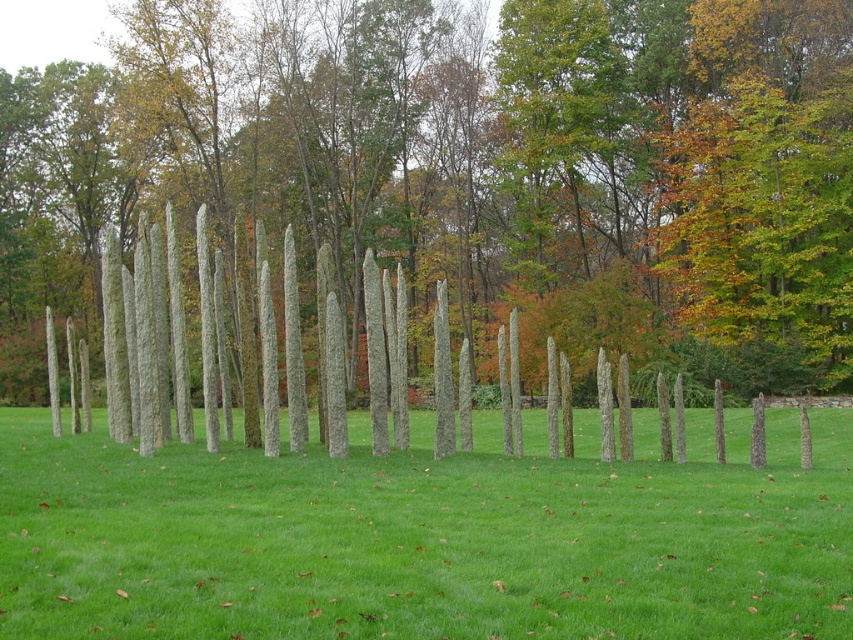
You are standing in the field among the obelisks and want to walk from the point at coordinates point [485,218] to the point at coordinates point [532,544]. Which direction should you face to move towards the second point?

Since point [485,218] is closer to you than point [532,544], you should face away from your current position towards the point [532,544] to move in the correct direction.

Looking at this image, you are a gardener who wants to plant a new flower bed between the smooth gray pole at center and the green grass at center. Which object should you move to make space?

The smooth gray pole at center is bigger than green grass at center, so you should move the smooth gray pole at center to make space for the flower bed.

You are standing in the middle of the field and see the smooth gray pole at center and the green grass at center. Which object is positioned higher from the ground?

The smooth gray pole at center is located above the green grass at center, so it is positioned higher from the ground.